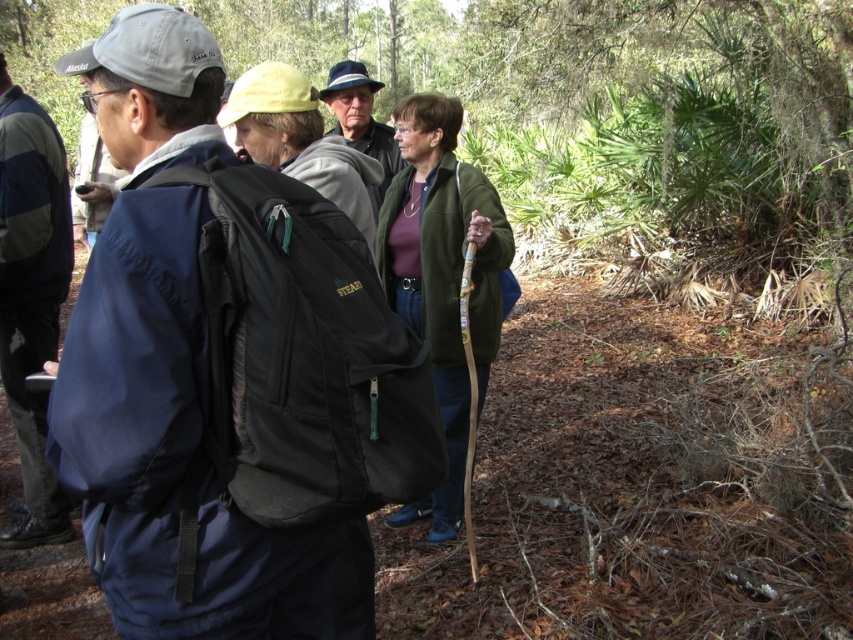
You are planning to pack for a day hike and have to choose between the green woolen jacket at center and the dark blue fabric jacket at left. Which jacket would be more suitable if you need a thicker layer for colder weather?

A: The dark blue fabric jacket at left is thicker than the green woolen jacket at center, making it more suitable for colder weather.